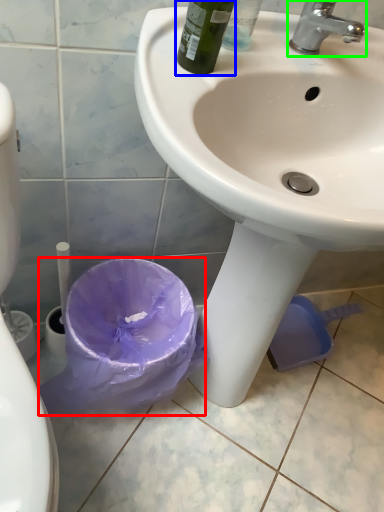
Question: Which object is positioned farthest from garbage (highlighted by a red box)? Select from bottle (highlighted by a blue box) and tap (highlighted by a green box).

Choices:
 (A) bottle
 (B) tap

Answer: (B)